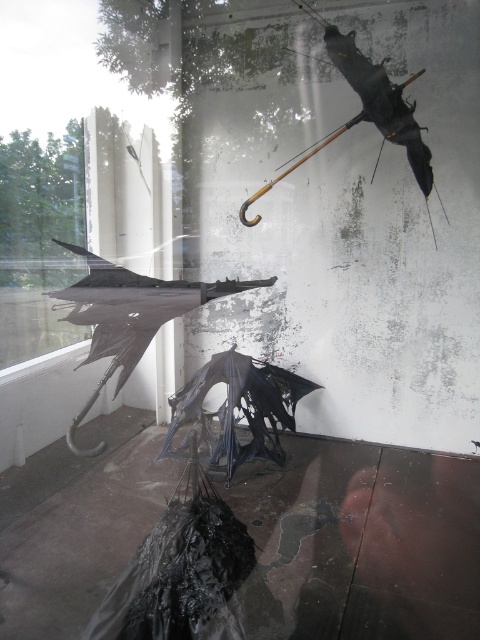
Question: Is transparent glass umbrella at left below matte black umbrella at center?

Choices:
 (A) yes
 (B) no

Answer: (B)

Question: Which point is closer to the camera taking this photo?

Choices:
 (A) (222, 429)
 (B) (24, 145)
 (C) (115, 368)

Answer: (C)

Question: Does matte black umbrella at center have a larger size compared to transparent plastic umbrella at center?

Choices:
 (A) yes
 (B) no

Answer: (A)

Question: Which of the following is the farthest from the observer?

Choices:
 (A) (236, 442)
 (B) (94, 333)
 (C) (15, 193)

Answer: (C)

Question: Can you confirm if matte black umbrella at center is positioned to the right of transparent plastic umbrella at center?

Choices:
 (A) no
 (B) yes

Answer: (A)

Question: Which object is positioned farthest from the transparent glass umbrella at left?

Choices:
 (A) transparent plastic umbrella at center
 (B) matte black umbrella at center

Answer: (B)